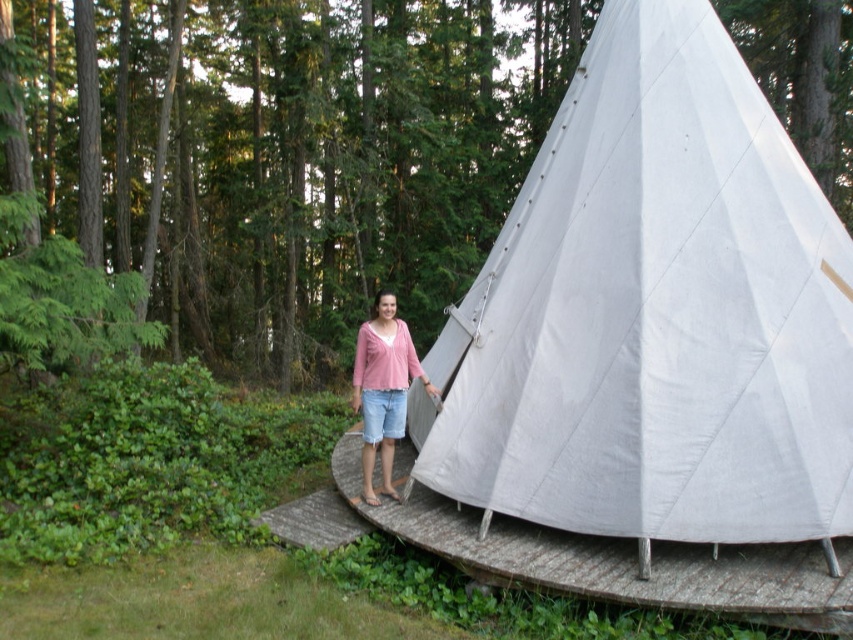
Is white canvas tent at center to the right of white fabric ramp at lower center from the viewer's perspective?

Correct, you'll find white canvas tent at center to the right of white fabric ramp at lower center.

Where is `white canvas tent at center`? white canvas tent at center is located at coordinates (654, 314).

Between point (447, 337) and point (467, 557), which one is positioned behind?

Positioned behind is point (447, 337).

Where is `white canvas tent at center`? The image size is (853, 640). white canvas tent at center is located at coordinates (654, 314).

Between point (683, 586) and point (416, 378), which one is positioned in front?

Point (683, 586) is in front.

Is white fabric ramp at lower center in front of matte pink sweater at center?

Yes.

Measure the distance between white fabric ramp at lower center and camera.

white fabric ramp at lower center is 4.18 meters away from camera.

Locate an element on the screen. This screenshot has height=640, width=853. white fabric ramp at lower center is located at coordinates (614, 560).

Looking at this image, is white canvas tent at center closer to the viewer compared to matte pink sweater at center?

That is True.

Is white canvas tent at center shorter than matte pink sweater at center?

No, white canvas tent at center is not shorter than matte pink sweater at center.

What do you see at coordinates (654, 314) in the screenshot? I see `white canvas tent at center` at bounding box center [654, 314].

Identify the location of white canvas tent at center. (654, 314).